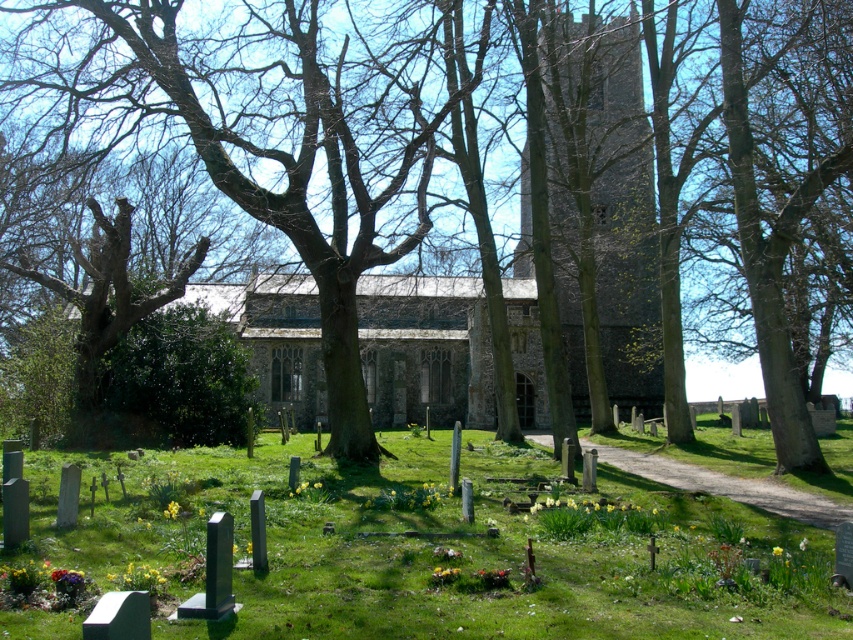
You are standing in the churchyard and want to take a photo of the gray stone tower at center. Where should you position yourself relative to the green grassy at lower center to ensure the tower is fully visible in the background?

To ensure the gray stone tower at center is fully visible in the background, you should position yourself behind the green grassy at lower center since it is in front of the tower.